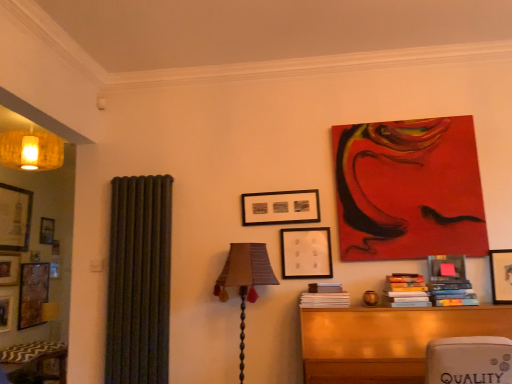
Question: Can you confirm if textured fabric lampshade at center is thinner than matte black picture frame at center, placed as the 2th picture frame when sorted from front to back?

Choices:
 (A) yes
 (B) no

Answer: (B)

Question: Is matte black picture frame at center, arranged as the second picture frame when viewed from the left, at the back of textured fabric lampshade at center?

Choices:
 (A) yes
 (B) no

Answer: (B)

Question: Can you confirm if textured fabric lampshade at center is bigger than matte black picture frame at center, the second picture frame in the right-to-left sequence?

Choices:
 (A) no
 (B) yes

Answer: (B)

Question: Is the depth of textured fabric lampshade at center greater than that of matte black picture frame at center, arranged as the second picture frame when viewed from the left?

Choices:
 (A) no
 (B) yes

Answer: (A)

Question: Is textured fabric lampshade at center completely or partially outside of matte black picture frame at center, the second picture frame in the right-to-left sequence?

Choices:
 (A) no
 (B) yes

Answer: (B)

Question: Considering the relative sizes of textured fabric lampshade at center and matte black picture frame at center, the second picture frame in the right-to-left sequence, in the image provided, is textured fabric lampshade at center smaller than matte black picture frame at center, the second picture frame in the right-to-left sequence,?

Choices:
 (A) yes
 (B) no

Answer: (B)

Question: Is wooden table at lower right touching wooden book at lower right, which ranks as the first book in left-to-right order?

Choices:
 (A) yes
 (B) no

Answer: (B)

Question: Would you consider wooden table at lower right to be distant from wooden book at lower right, the third book when ordered from right to left?

Choices:
 (A) no
 (B) yes

Answer: (A)

Question: Does wooden table at lower right appear on the left side of wooden book at lower right, which ranks as the first book in left-to-right order?

Choices:
 (A) no
 (B) yes

Answer: (A)

Question: Considering the relative sizes of wooden table at lower right and wooden book at lower right, the third book when ordered from right to left, in the image provided, is wooden table at lower right smaller than wooden book at lower right, the third book when ordered from right to left,?

Choices:
 (A) no
 (B) yes

Answer: (A)

Question: From a real-world perspective, is wooden table at lower right physically above wooden book at lower right, the third book when ordered from right to left?

Choices:
 (A) yes
 (B) no

Answer: (B)

Question: From the image's perspective, would you say wooden table at lower right is positioned over wooden book at lower right, the third book when ordered from right to left?

Choices:
 (A) yes
 (B) no

Answer: (B)

Question: Is wooden picture frame at upper right, the first picture frame in the right-to-left sequence, thinner than matte black picture frame at center, placed as the 2th picture frame when sorted from front to back?

Choices:
 (A) yes
 (B) no

Answer: (B)